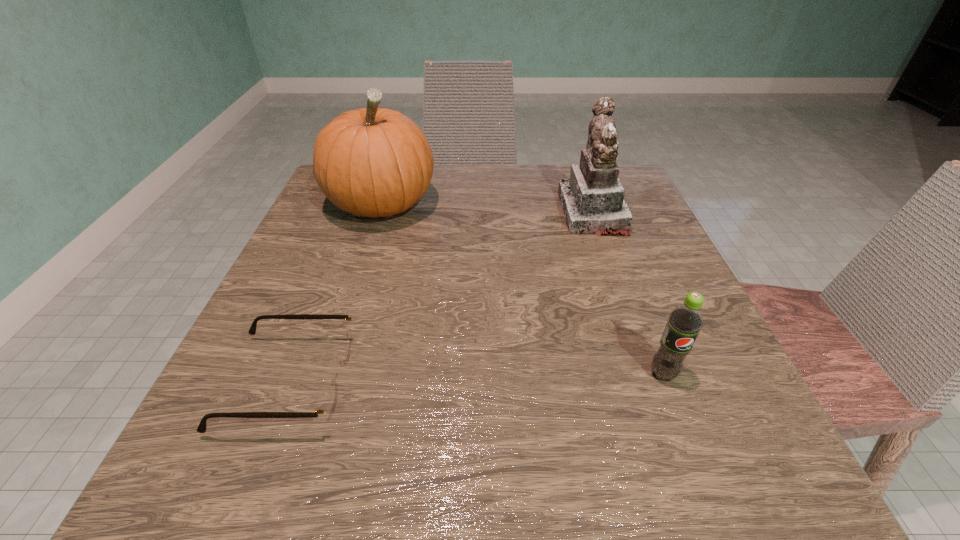
Find the location of `pumpkin situated at the far edge`. pumpkin situated at the far edge is located at coordinates click(x=373, y=162).

The image size is (960, 540). In order to click on figurine situated at the far edge in this screenshot , I will do point(592,200).

Locate an element on the screen. The width and height of the screenshot is (960, 540). object situated at the near edge is located at coordinates (329, 403).

Where is `pumpkin at the left edge`? This screenshot has width=960, height=540. pumpkin at the left edge is located at coordinates click(373, 162).

Locate an element on the screen. This screenshot has height=540, width=960. spectacles at the left edge is located at coordinates (329, 403).

Image resolution: width=960 pixels, height=540 pixels. Identify the location of figurine that is at the right edge. (592, 200).

This screenshot has height=540, width=960. I want to click on soda that is at the right edge, so click(685, 321).

Locate an element on the screen. The height and width of the screenshot is (540, 960). object that is at the far left corner is located at coordinates (373, 162).

Locate an element on the screen. This screenshot has width=960, height=540. object that is at the near left corner is located at coordinates (329, 403).

Where is `object that is at the far right corner`? object that is at the far right corner is located at coordinates (592, 200).